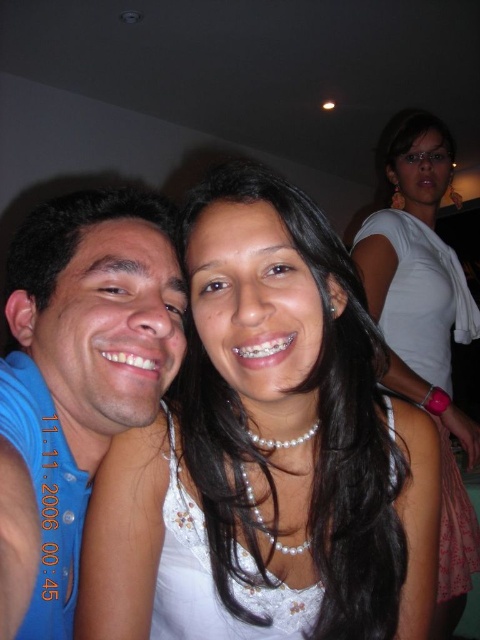
Between pearl necklace at center and blue cotton shirt at left, which one has more height?

blue cotton shirt at left is taller.

Who is more forward, (x=272, y=333) or (x=148, y=204)?

Point (x=272, y=333) is in front.

Between point (362, 493) and point (148, 300), which one is positioned behind?

Positioned behind is point (148, 300).

Find the location of a particular element. The image size is (480, 640). pearl necklace at center is located at coordinates (266, 451).

Is the position of blue cotton shirt at left more distant than that of white pearl necklace at upper center?

No, it is not.

Does point (22, 429) come closer to viewer compared to point (431, 168)?

Yes.

Where is `blue cotton shirt at left`? Image resolution: width=480 pixels, height=640 pixels. blue cotton shirt at left is located at coordinates (84, 360).

Who is more distant from viewer, (357, 593) or (441, 372)?

The point (441, 372) is more distant.

Does pearl necklace at center have a lesser width compared to white pearl necklace at upper center?

Correct, pearl necklace at center's width is less than white pearl necklace at upper center's.

In order to click on pearl necklace at center in this screenshot , I will do (x=266, y=451).

You are a GUI agent. You are given a task and a screenshot of the screen. Output one action in this format:
    pyautogui.click(x=<x>, y=<y>)
    Task: Click on the pearl necklace at center
    The width and height of the screenshot is (480, 640).
    Given the screenshot: What is the action you would take?
    pyautogui.click(x=266, y=451)